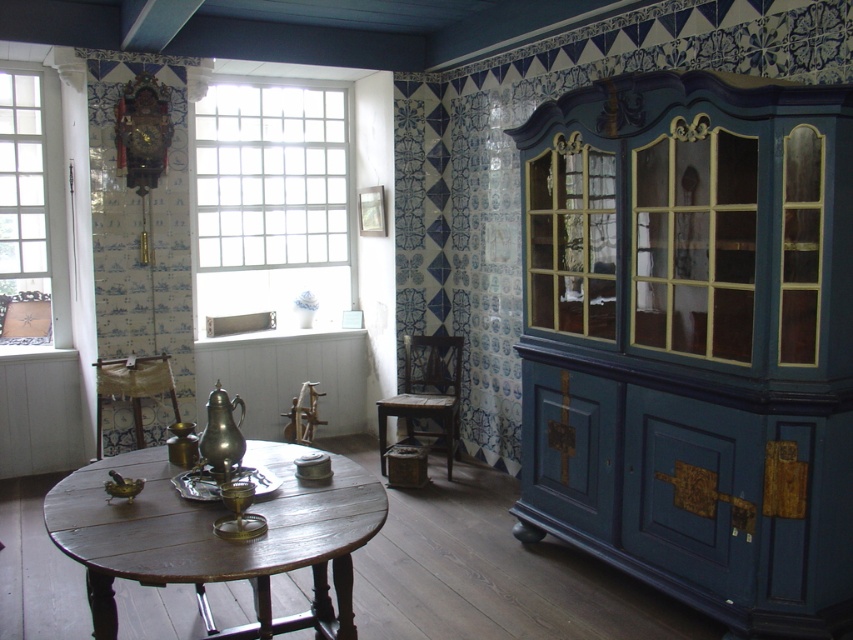
Between white glass window at center and clear glass window at left, which one has less height?

clear glass window at left is shorter.

Which is more to the left, white glass window at center or clear glass window at left?

Positioned to the left is clear glass window at left.

What do you see at coordinates (271, 198) in the screenshot?
I see `white glass window at center` at bounding box center [271, 198].

The width and height of the screenshot is (853, 640). Identify the location of white glass window at center. (271, 198).

Consider the image. Which of these two, wooden polished table at center or wooden chair at center, stands shorter?

Standing shorter between the two is wooden polished table at center.

Does wooden polished table at center appear over wooden chair at center?

Actually, wooden polished table at center is below wooden chair at center.

Consider the image. Who is more distant from viewer, (242, 561) or (457, 401)?

Positioned behind is point (457, 401).

Identify the location of wooden polished table at center. (218, 538).

Between point (27, 221) and point (457, 388), which one is positioned in front?

Positioned in front is point (457, 388).

Find the location of a particular element. clear glass window at left is located at coordinates coord(22,202).